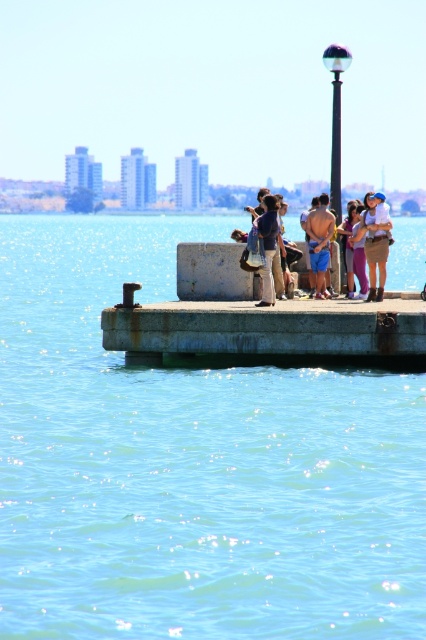
You are standing on the concrete pier and want to walk towards the city skyline in the background. You notice two points marked on the pier surface at coordinates point (262, 196) and point (331, 234). Which point should you step on first to move closer to the city skyline?

You should step on point (331, 234) first because it is farther from the viewer compared to point (262, 196), which is closer. Since you want to move toward the city skyline in the background, stepping on the farther point aligns better with your direction.

You are a photographer standing on the concrete pier and want to place your camera at the center of the image to capture the denim jacket at center. What are the coordinates you should aim for?

The coordinates for the denim jacket at center are at point (353, 248). So you should aim your camera at those coordinates to capture the denim jacket at center.

You are a photographer planning to take a photo of the denim jacket at center and the shiny blue shorts at center from a distance of 5 meters. Which object will appear bigger in the photo?

The denim jacket at center will appear bigger in the photo because it is larger in size than the shiny blue shorts at center.